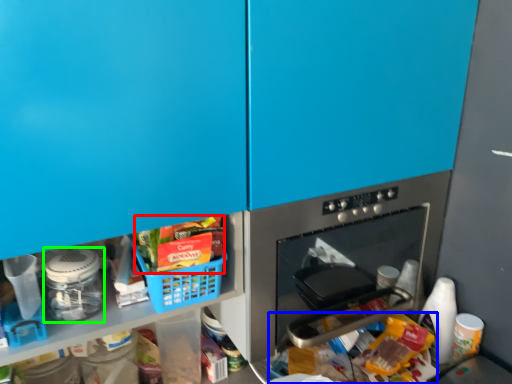
Question: Which object is positioned closest to food (highlighted by a red box)? Select from food (highlighted by a blue box) and appliance (highlighted by a green box).

Choices:
 (A) food
 (B) appliance

Answer: (B)